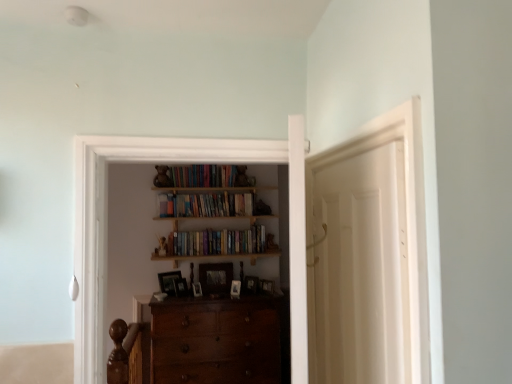
Locate an element on the screen. free spot above shiny brown wooden chest of drawers at center (from a real-world perspective) is located at coordinates (229, 301).